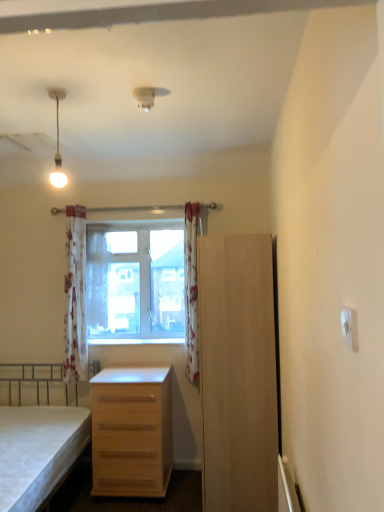
Question: Based on their sizes in the image, would you say light wood drawer at center is bigger or smaller than floral fabric curtain at center, the 3th curtain positioned from the right?

Choices:
 (A) small
 (B) big

Answer: (B)

Question: Considering the positions of light wood drawer at center and floral fabric curtain at center, the 3th curtain positioned from the right, in the image, is light wood drawer at center taller or shorter than floral fabric curtain at center, the 3th curtain positioned from the right,?

Choices:
 (A) short
 (B) tall

Answer: (A)

Question: Which is nearer to the floral fabric curtain at center, which is the first curtain in left-to-right order?

Choices:
 (A) white glossy lamp at upper left
 (B) transparent glass window at center
 (C) white plastic smoke detector at upper center
 (D) light wood drawer at center
 (E) white wood at center

Answer: (B)

Question: Which object is the closest to the white matte bed at lower left?

Choices:
 (A) white floral fabric curtain at center, which ranks as the second curtain in right-to-left order
 (B) transparent glass window at center
 (C) white wood at center
 (D) white plastic smoke detector at upper center
 (E) light wood drawer at center

Answer: (E)